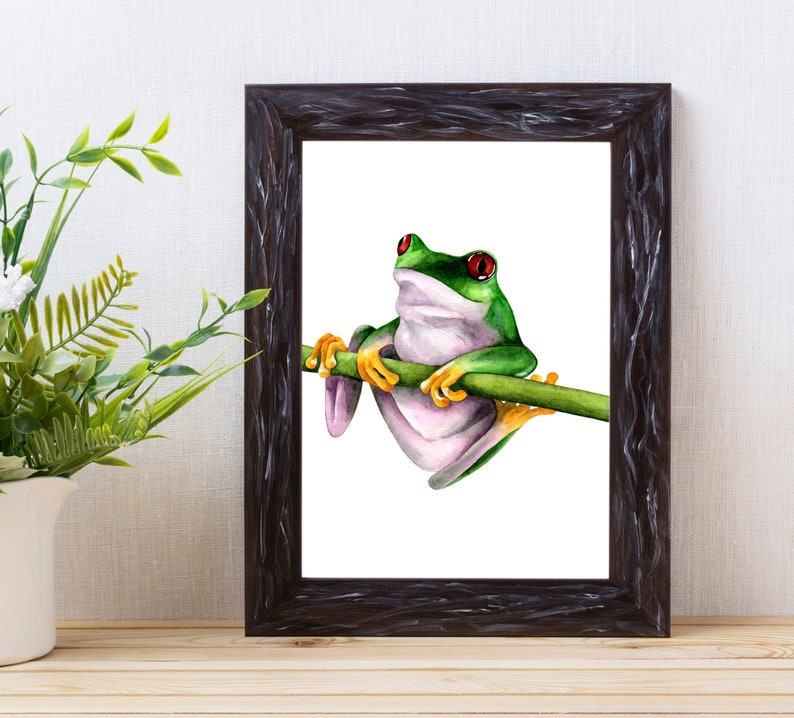
Identify the location of framed frog colored print. (568, 245).